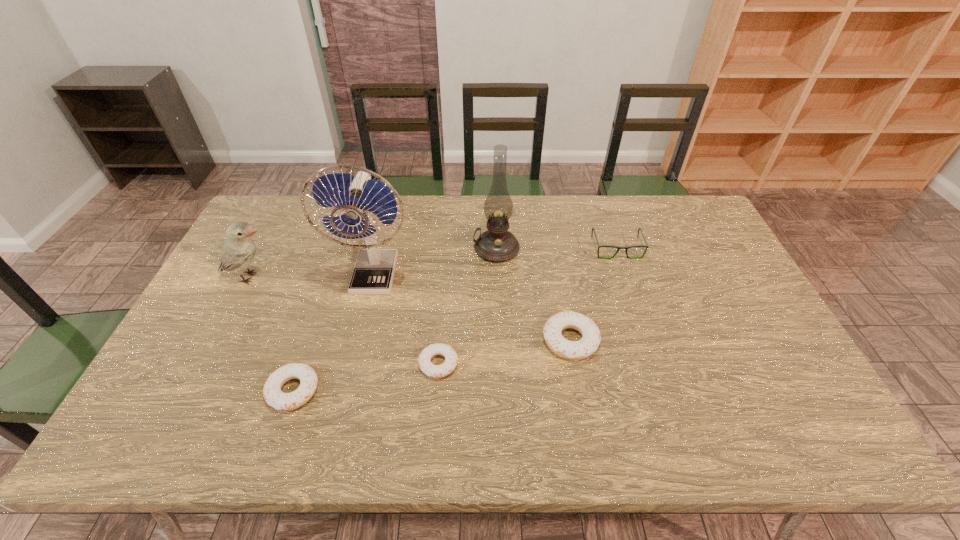
At what (x,y) coordinates should I click in order to perform the action: click on the fifth shortest object. Please return your answer as a coordinate pair (x, y). The width and height of the screenshot is (960, 540). Looking at the image, I should click on (238, 252).

Locate an element on the screen. This screenshot has width=960, height=540. vacant space located on the back of the second shortest doughnut is located at coordinates (336, 266).

Locate an element on the screen. The image size is (960, 540). vacant space located on the back of the shortest doughnut is located at coordinates (444, 293).

Locate an element on the screen. This screenshot has width=960, height=540. vacant space located on the back of the tallest doughnut is located at coordinates (553, 246).

This screenshot has height=540, width=960. Find the location of `free region located on the lens of the rightmost object`. free region located on the lens of the rightmost object is located at coordinates (653, 358).

In order to click on vacant space located on the front-facing side of the fan in this screenshot , I will do `click(364, 322)`.

This screenshot has width=960, height=540. Identify the location of free space located 0.370m on the right of the oil lamp. (633, 248).

Where is `vacant space located at the face of the bird`? This screenshot has width=960, height=540. vacant space located at the face of the bird is located at coordinates (319, 277).

I want to click on object that is at the far edge, so click(496, 244).

At what (x,y) coordinates should I click in order to perform the action: click on object located at the left edge. Please return your answer as a coordinate pair (x, y). Looking at the image, I should click on (238, 252).